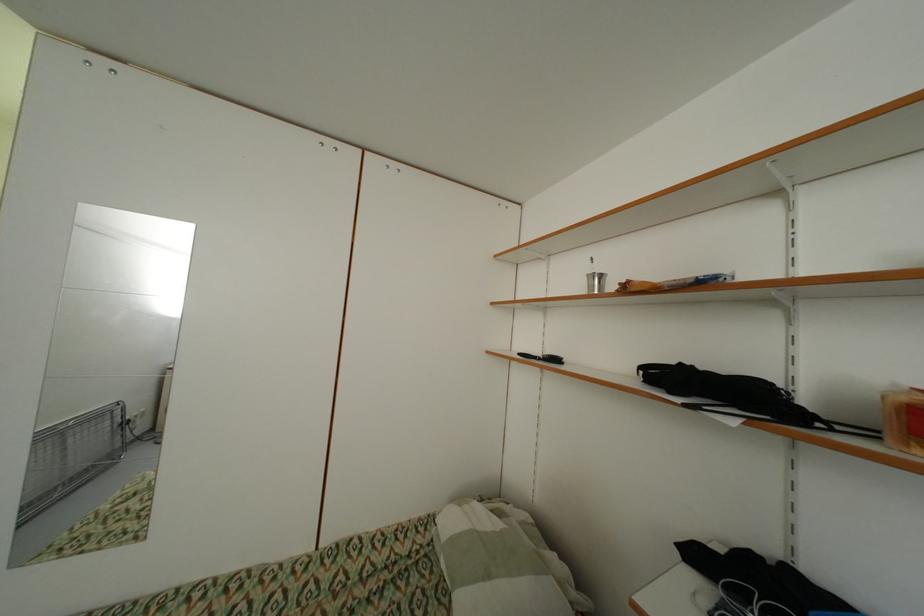
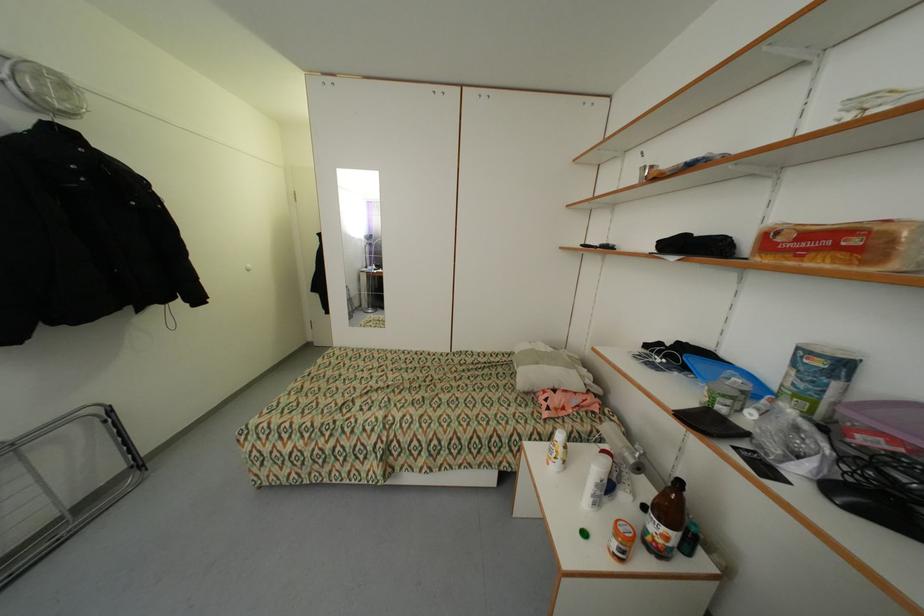
Locate, in the second image, the point that corresponds to (545,360) in the first image.

(602, 248)